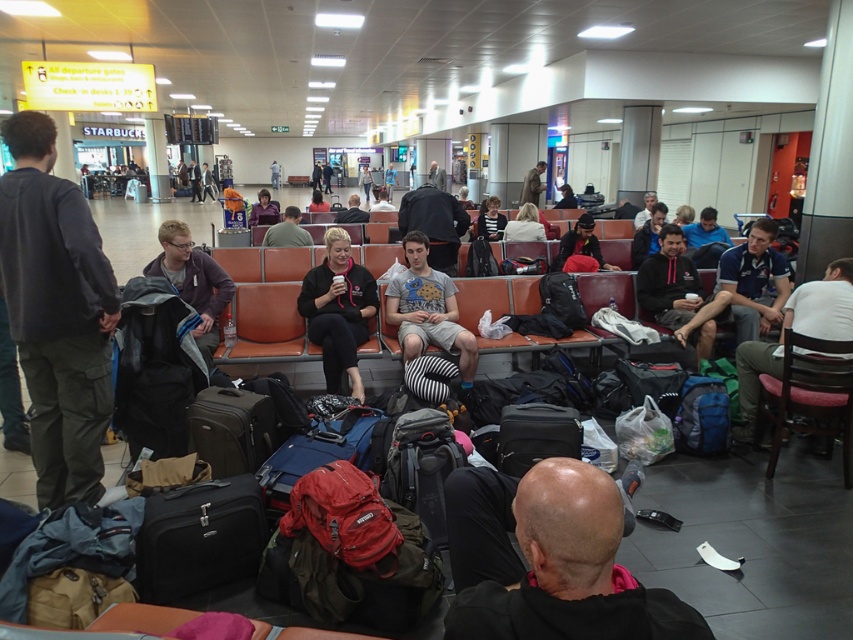
Question: Can you confirm if dark gray cotton jacket at left is positioned to the right of striped fabric shirt at center?

Choices:
 (A) yes
 (B) no

Answer: (B)

Question: Can you confirm if striped fabric pillow at center is positioned to the left of light brown leather jacket at center?

Choices:
 (A) yes
 (B) no

Answer: (A)

Question: Considering the real-world distances, which object is closest to the matte black suitcase at center?

Choices:
 (A) black fabric cap at lower center
 (B) white cotton shirt at right
 (C) dark gray cotton jacket at left

Answer: (C)

Question: Is black fleece jacket at center wider than white cotton shirt at right?

Choices:
 (A) no
 (B) yes

Answer: (A)

Question: Which is nearer to the black hardshell suitcase at lower left?

Choices:
 (A) black fleece jacket at center
 (B) black matte suitcase at center

Answer: (B)

Question: Among these objects, which one is nearest to the camera?

Choices:
 (A) striped fabric pillow at center
 (B) dark gray cotton jacket at left
 (C) black fabric cap at lower center
 (D) black fleece jacket at center

Answer: (C)